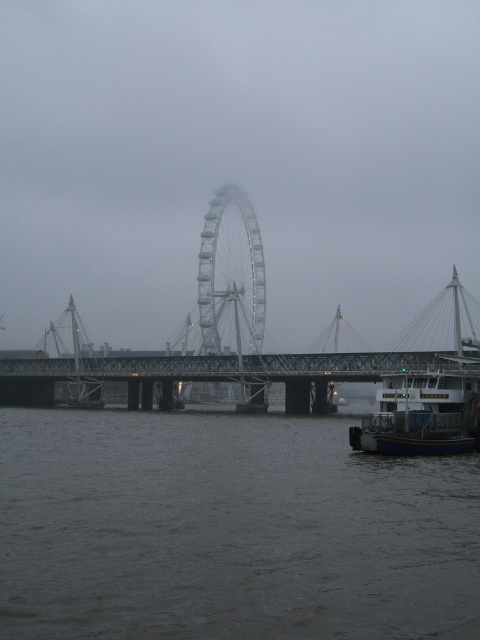
Can you confirm if gray water at lower center is positioned below metal ferris wheel at center?

Yes, gray water at lower center is below metal ferris wheel at center.

Does point (118, 452) come in front of point (251, 241)?

Yes, point (118, 452) is closer to viewer.

Between point (280, 580) and point (257, 349), which one is positioned behind?

Point (257, 349)

Image resolution: width=480 pixels, height=640 pixels. In order to click on gray water at lower center in this screenshot , I will do `click(228, 531)`.

Who is positioned more to the right, gray water at lower center or metallic bridge at center?

gray water at lower center is more to the right.

Locate an element on the screen. gray water at lower center is located at coordinates (228, 531).

Where is `gray water at lower center`? gray water at lower center is located at coordinates (228, 531).

Does gray water at lower center have a lesser height compared to metallic gray bridge at center?

Indeed, gray water at lower center has a lesser height compared to metallic gray bridge at center.

Between gray water at lower center and metallic gray bridge at center, which one is positioned higher?

metallic gray bridge at center is above.

Identify the location of gray water at lower center. pos(228,531).